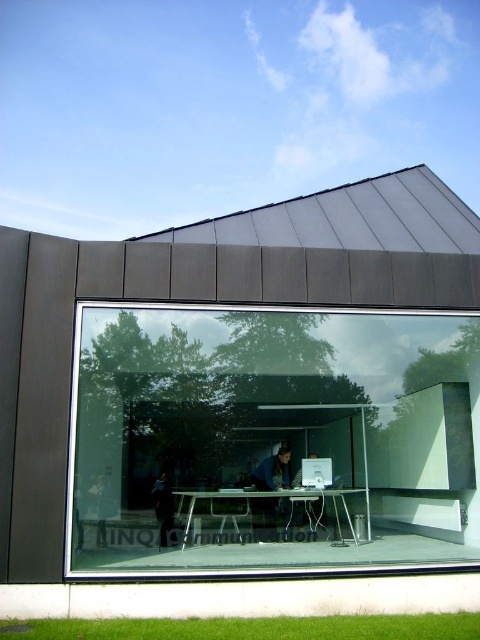
You are standing outside the building and want to enter through the transparent glass door at center. Based on the coordinates provided in the Objects Description, can you estimate the door location relative to the glass facade?

The transparent glass door at center is located at coordinates point (276,435), which places it near the central area of the glass facade, making it easily accessible from the exterior.

You are an interior designer observing the modern architectural structure. You notice two items of dark blue fabric at center and dark blue fabric jacket at center. Which one is positioned lower in the scene?

The dark blue fabric at center is positioned lower because it is below the dark blue fabric jacket at center.

You are an office worker who needs to carry a large box measuring 1.2 meters in width through the transparent glass door at center. The white glossy computer at center is in your path. Can you pass through the door without moving the computer?

The transparent glass door at center is wider than the white glossy computer at center, so the 1.2 meter box can pass through the door without needing to move the computer.